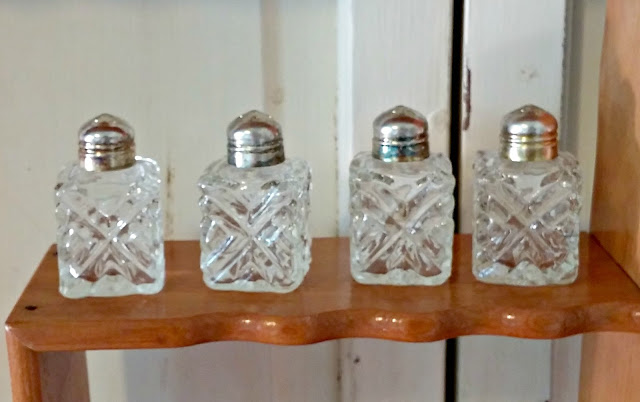
Find the location of a particular element. shelf is located at coordinates (189, 307).